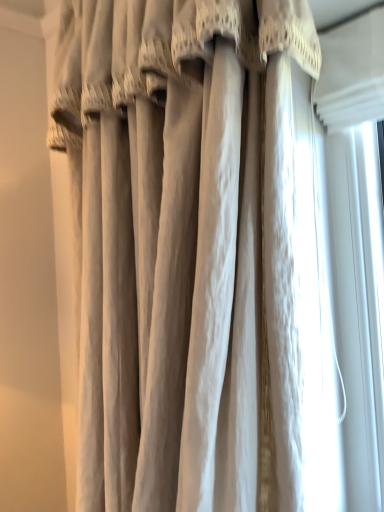
Describe the element at coordinates (185, 249) in the screenshot. The width and height of the screenshot is (384, 512). I see `beige fabric curtain at center` at that location.

The width and height of the screenshot is (384, 512). I want to click on beige fabric curtain at center, so click(x=185, y=249).

The image size is (384, 512). Identify the location of beige fabric curtain at center. (185, 249).